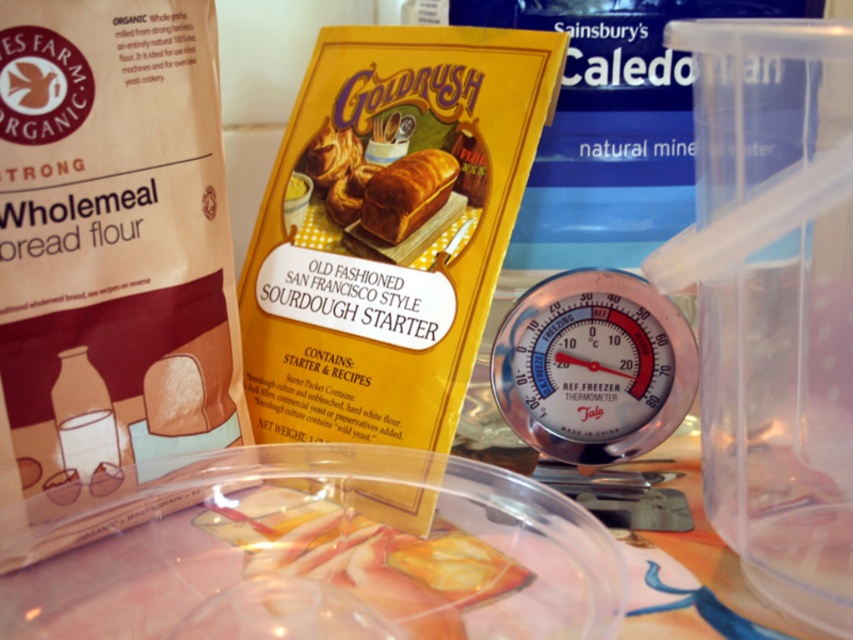
You are a baker preparing to check the temperature of the golden crusty loaf of bread at center. You see the transparent plastic thermometer at center nearby. Which direction should you move your hand to reach the thermometer from the bread?

The transparent plastic thermometer at center is to the right of the golden crusty loaf of bread at center, so you should move your hand to the right to reach the thermometer from the bread.

You are a baker trying to measure the temperature of the golden crusty loaf of bread at center. You have a transparent plastic thermometer at center. Can you accurately measure the temperature of the bread using the thermometer without moving either item?

The transparent plastic thermometer at center and golden crusty loaf of bread at center are 3.71 inches apart, so you cannot accurately measure the temperature of the bread using the thermometer without moving either item because they are not in contact.

In the scene shown: You are a baker preparing to check the temperature of the golden crusty loaf of bread at center. You have the transparent plastic thermometer at center. Can you use this thermometer to accurately measure the internal temperature of the loaf?

The transparent plastic thermometer at center has a larger size compared to golden crusty loaf of bread at center, so it might not fit properly inside the loaf to measure the temperature accurately.